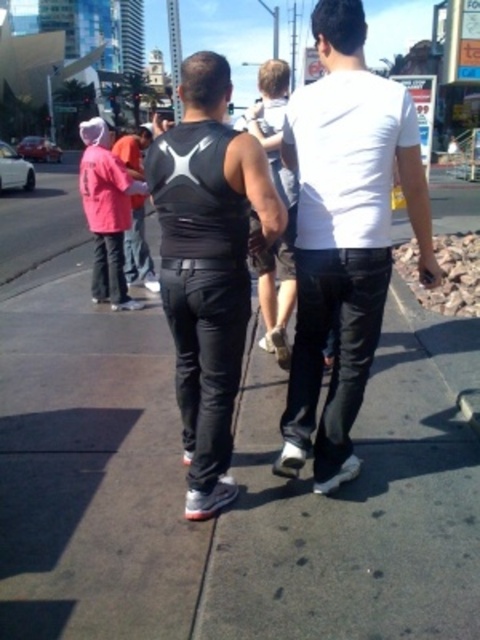
You are a photographer trying to capture a candid shot of both the black matte vest at center and the pink fabric shirt at left. Based on their positions, which one should you focus on first to ensure both are in frame?

The black matte vest at center is to the right of the pink fabric shirt at left. To capture both in frame, focus on the pink fabric shirt at left first, then adjust the camera to include the black matte vest at center to its right.

You are standing at the point marked by the coordinates point (235, 504) in the image. What surface are you currently standing on?

The point (235, 504) marks the gray concrete sidewalk at center, so you are standing on the gray concrete sidewalk at center.

You are a delivery drone flying above the urban street scene. You need to land on the gray concrete sidewalk at center. What are the coordinates where you should land?

The gray concrete sidewalk at center is located at coordinates point (235, 504). You should land there.